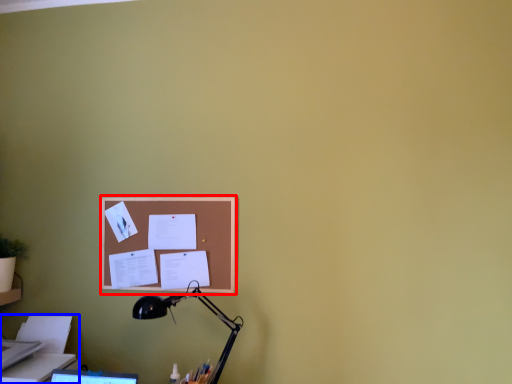
Question: Among these objects, which one is farthest to the camera, bulletin board (highlighted by a red box) or printer (highlighted by a blue box)?

Choices:
 (A) bulletin board
 (B) printer

Answer: (A)